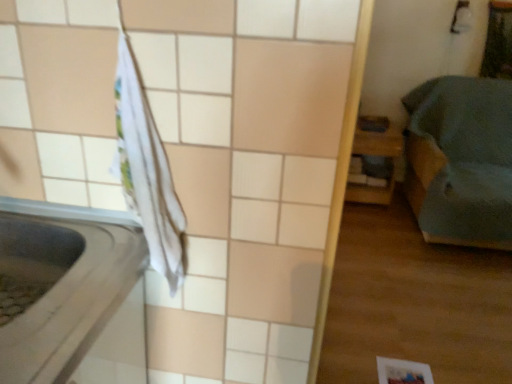
Question: Is white fabric at left outside teal fabric bed at right, positioned as the second furniture in left-to-right order?

Choices:
 (A) yes
 (B) no

Answer: (A)

Question: Considering the relative positions of white fabric at left and teal fabric bed at right, positioned as the second furniture in left-to-right order, in the image provided, is white fabric at left behind teal fabric bed at right, positioned as the second furniture in left-to-right order,?

Choices:
 (A) no
 (B) yes

Answer: (A)

Question: Is white fabric at left oriented away from teal fabric bed at right, positioned as the second furniture in left-to-right order?

Choices:
 (A) yes
 (B) no

Answer: (B)

Question: Is white fabric at left to the left of teal fabric bed at right, the 1th furniture positioned from the right, from the viewer's perspective?

Choices:
 (A) no
 (B) yes

Answer: (B)

Question: Would you consider white fabric at left to be distant from teal fabric bed at right, positioned as the second furniture in left-to-right order?

Choices:
 (A) no
 (B) yes

Answer: (B)

Question: Would you say teal fabric bed at right, the 1th furniture positioned from the right, is to the left or to the right of white fabric at left in the picture?

Choices:
 (A) right
 (B) left

Answer: (A)

Question: Considering the positions of teal fabric bed at right, positioned as the second furniture in left-to-right order, and white fabric at left in the image, is teal fabric bed at right, positioned as the second furniture in left-to-right order, bigger or smaller than white fabric at left?

Choices:
 (A) big
 (B) small

Answer: (A)

Question: Is point (455, 225) closer or farther from the camera than point (47, 286)?

Choices:
 (A) farther
 (B) closer

Answer: (A)

Question: Is teal fabric bed at right, the 1th furniture positioned from the right, in front of or behind white fabric at left in the image?

Choices:
 (A) behind
 (B) front

Answer: (A)

Question: Is point (415, 200) positioned closer to the camera than point (415, 365)?

Choices:
 (A) farther
 (B) closer

Answer: (A)

Question: Considering the relative positions of teal fabric bed at right, the 1th furniture positioned from the right, and white matte paper at lower right in the image provided, is teal fabric bed at right, the 1th furniture positioned from the right, to the left or to the right of white matte paper at lower right?

Choices:
 (A) left
 (B) right

Answer: (B)

Question: From their relative heights in the image, would you say teal fabric bed at right, positioned as the second furniture in left-to-right order, is taller or shorter than white matte paper at lower right?

Choices:
 (A) tall
 (B) short

Answer: (A)

Question: Is teal fabric bed at right, the 1th furniture positioned from the right, bigger or smaller than white matte paper at lower right?

Choices:
 (A) big
 (B) small

Answer: (A)

Question: From a real-world perspective, relative to teal fabric bed at right, the 1th furniture positioned from the right, is white matte paper at lower right vertically above or below?

Choices:
 (A) above
 (B) below

Answer: (B)

Question: Is white matte paper at lower right wider or thinner than teal fabric bed at right, positioned as the second furniture in left-to-right order?

Choices:
 (A) thin
 (B) wide

Answer: (A)